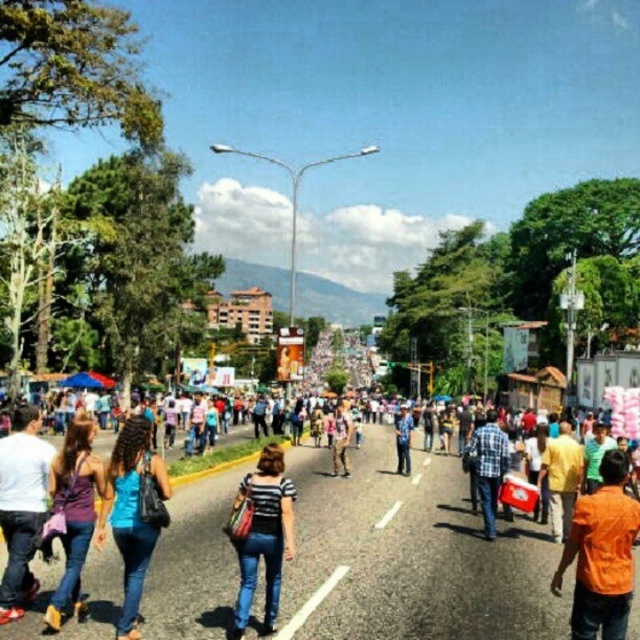
Question: Among these objects, which one is nearest to the camera?

Choices:
 (A) blue denim jeans at center
 (B) multicolored fabric crowd at center
 (C) purple fabric dress at center

Answer: (B)

Question: Is striped fabric shirt at center closer to camera compared to plaid fabric shirt at center?

Choices:
 (A) yes
 (B) no

Answer: (A)

Question: Is multicolored fabric crowd at center below blue plaid shirt at center?

Choices:
 (A) no
 (B) yes

Answer: (A)

Question: Which of these objects is positioned farthest from the striped fabric shirt at center?

Choices:
 (A) blue denim jeans at center
 (B) multicolored fabric crowd at center
 (C) denim jeans at lower left
 (D) orange fabric shirt at lower right

Answer: (D)

Question: Which object is farther from the camera taking this photo?

Choices:
 (A) blue plaid shirt at center
 (B) multicolored fabric crowd at center
 (C) orange fabric shirt at lower right

Answer: (A)

Question: Can you confirm if blue denim jeans at center is smaller than blue plaid shirt at center?

Choices:
 (A) no
 (B) yes

Answer: (B)